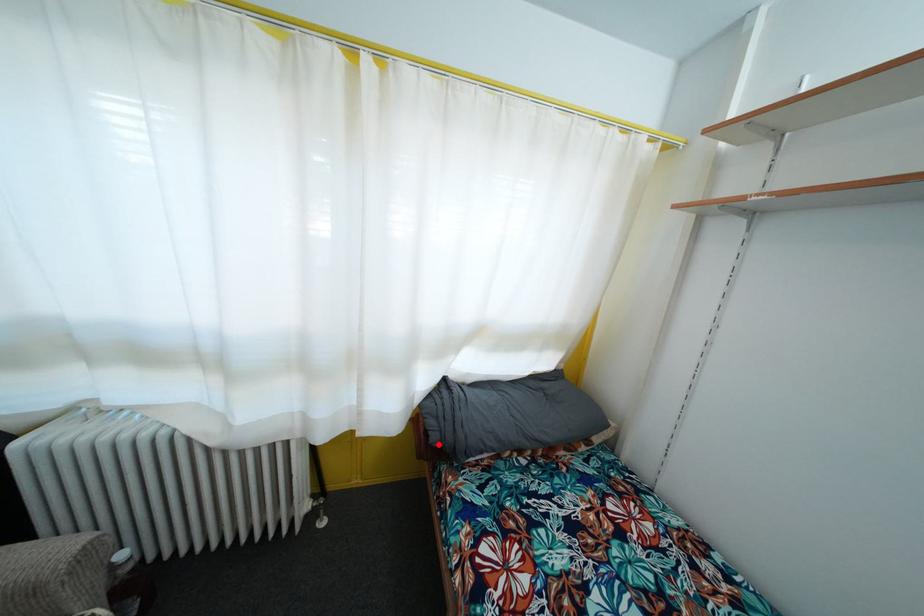
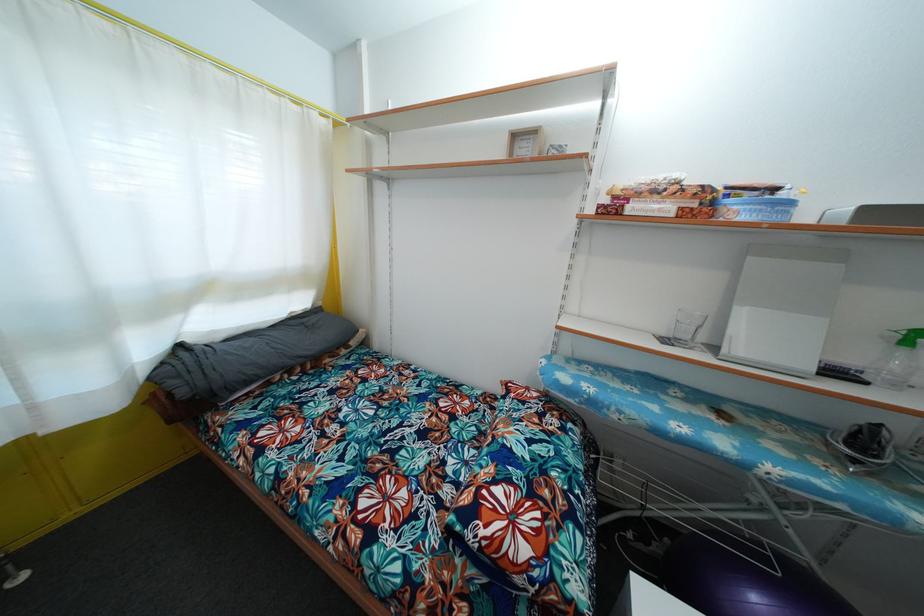
Question: I am providing you with two images of the same scene from different viewpoints. Image1 has a red point marked. In image2, the corresponding 3D location appears at what relative position? Reply with the corresponding letter.

Choices:
 (A) Closer
 (B) Farther

Answer: (A)